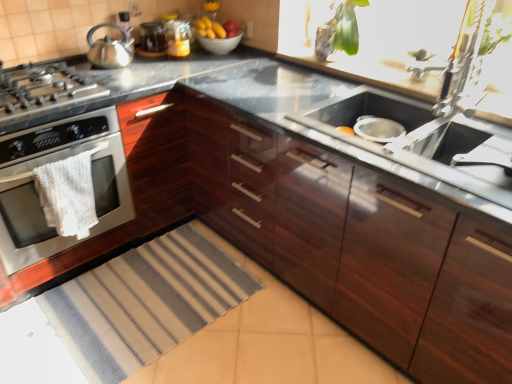
This screenshot has width=512, height=384. Find the location of `empty space that is to the right of striped fabric rug at lower left`. empty space that is to the right of striped fabric rug at lower left is located at coordinates (242, 336).